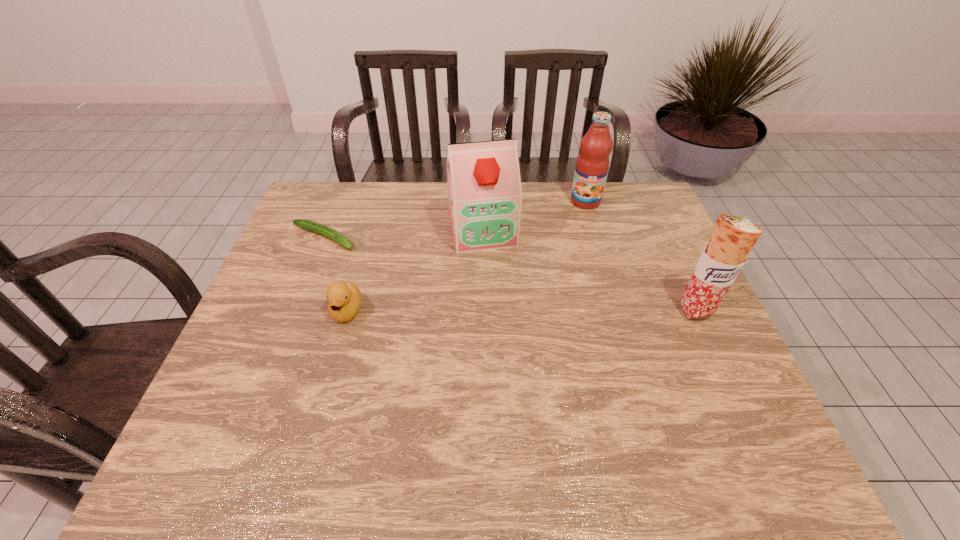
Where is `vacant space situated 0.320m on the front-facing side of the zucchini`? The width and height of the screenshot is (960, 540). vacant space situated 0.320m on the front-facing side of the zucchini is located at coordinates (439, 285).

I want to click on free space located on the front-facing side of the zucchini, so click(363, 251).

Locate an element on the screen. This screenshot has width=960, height=540. free space located 0.170m on the front-facing side of the zucchini is located at coordinates (396, 266).

This screenshot has width=960, height=540. I want to click on vacant space situated on the front label of the fruit juice, so click(x=578, y=263).

Identify the location of free region located on the front label of the fruit juice. (582, 229).

The height and width of the screenshot is (540, 960). What are the coordinates of `free point located 0.320m on the front label of the fruit juice` in the screenshot? It's located at (577, 278).

What are the coordinates of `soya milk located at the far edge` in the screenshot? It's located at (485, 194).

Locate an element on the screen. The image size is (960, 540). zucchini that is at the far edge is located at coordinates (309, 225).

This screenshot has height=540, width=960. I want to click on fruit juice situated at the far edge, so click(592, 165).

At what (x,y) coordinates should I click in order to perform the action: click on object present at the left edge. Please return your answer as a coordinate pair (x, y). Looking at the image, I should click on (309, 225).